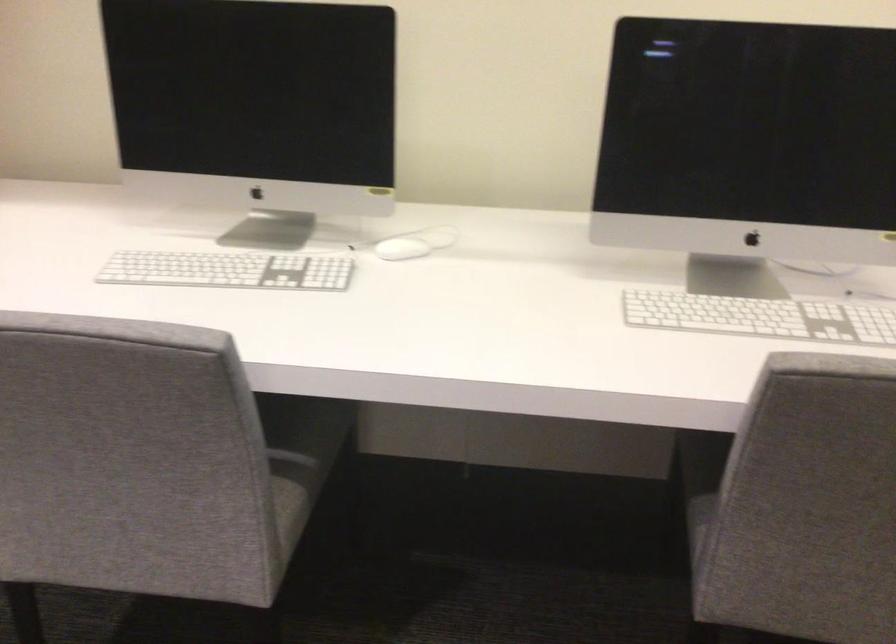
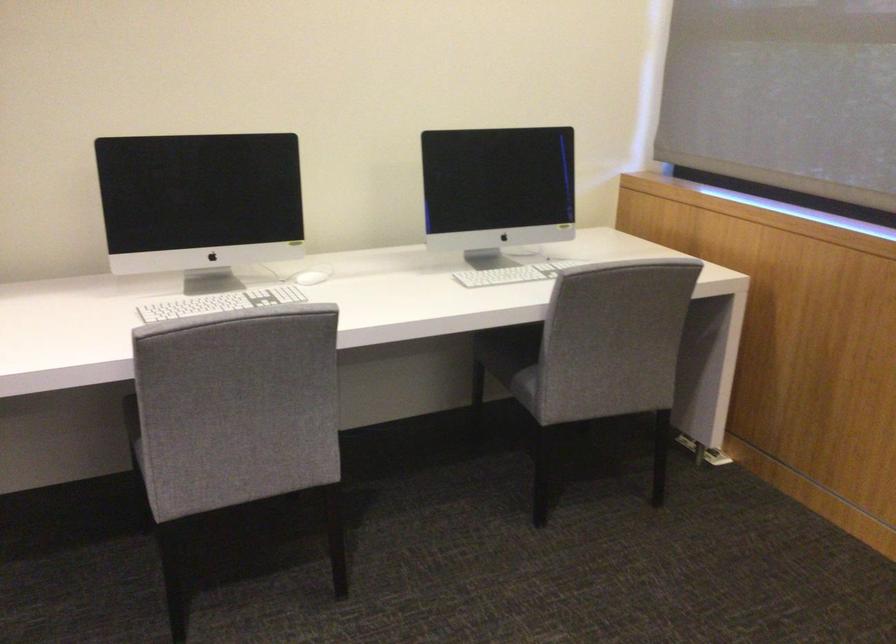
Find the pixel in the second image that matches point (757, 312) in the first image.

(519, 270)